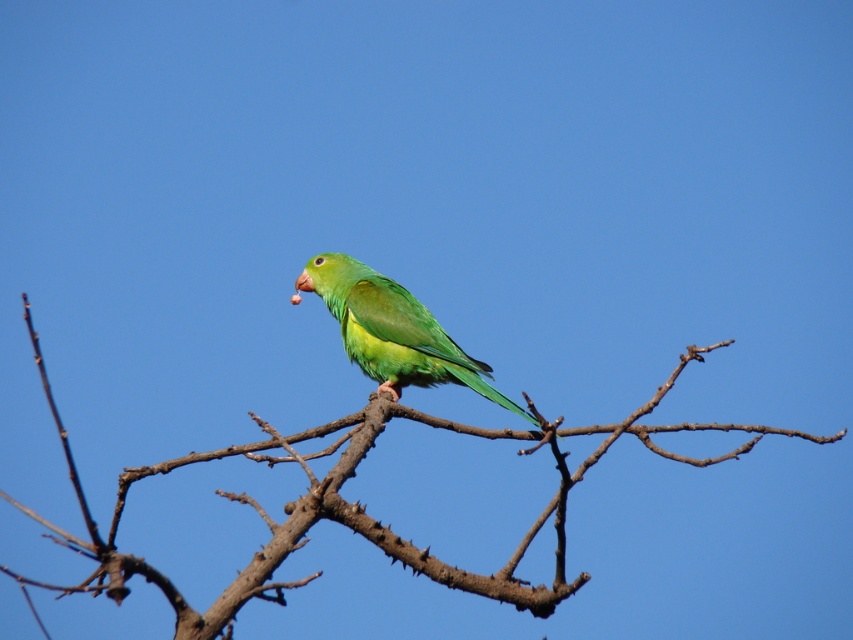
Question: Is brown rough branch at center thinner than green matte parrot at center?

Choices:
 (A) no
 (B) yes

Answer: (A)

Question: Can you confirm if brown rough branch at center is smaller than green matte parrot at center?

Choices:
 (A) no
 (B) yes

Answer: (A)

Question: Which point is closer to the camera?

Choices:
 (A) green matte parrot at center
 (B) brown rough branch at center

Answer: (B)

Question: Can you confirm if brown rough branch at center is positioned to the left of green matte parrot at center?

Choices:
 (A) yes
 (B) no

Answer: (A)